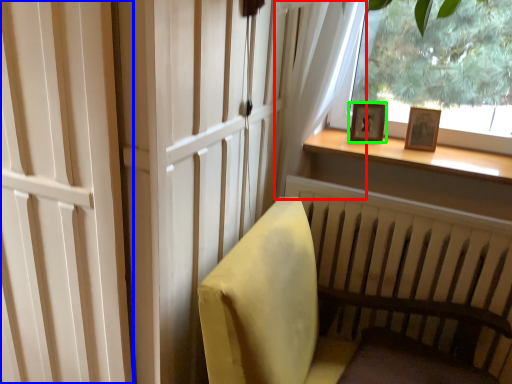
Question: Estimate the real-world distances between objects in this image. Which object is closer to curtain (highlighted by a red box), screen door (highlighted by a blue box) or picture frame (highlighted by a green box)?

Choices:
 (A) screen door
 (B) picture frame

Answer: (B)